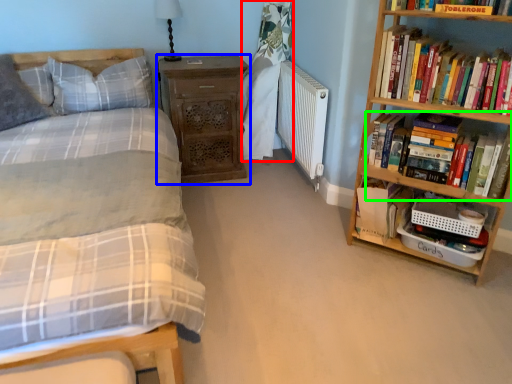
Question: Which object is the closest to the curtain (highlighted by a red box)? Choose among these: nightstand (highlighted by a blue box) or book (highlighted by a green box).

Choices:
 (A) nightstand
 (B) book

Answer: (A)